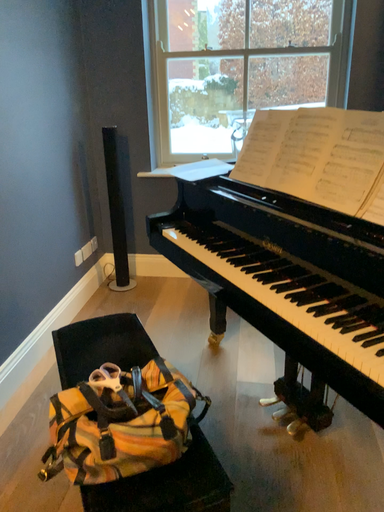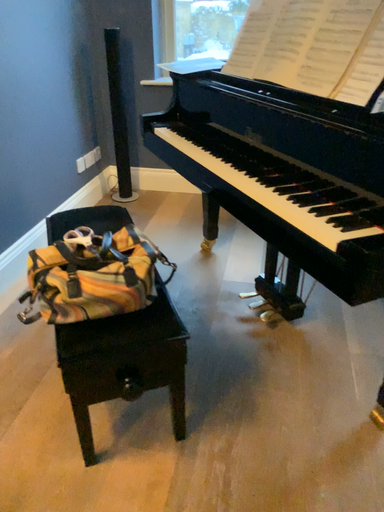
Question: Which way did the camera rotate in the video?

Choices:
 (A) rotated upward
 (B) rotated downward

Answer: (B)